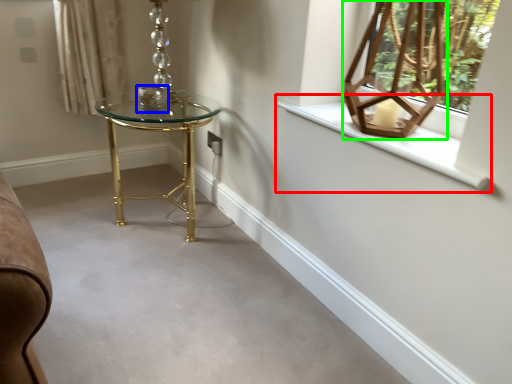
Question: Estimate the real-world distances between objects in this image. Which object is closer to window sill (highlighted by a red box), candle holder (highlighted by a blue box) or table lamp (highlighted by a green box)?

Choices:
 (A) candle holder
 (B) table lamp

Answer: (B)